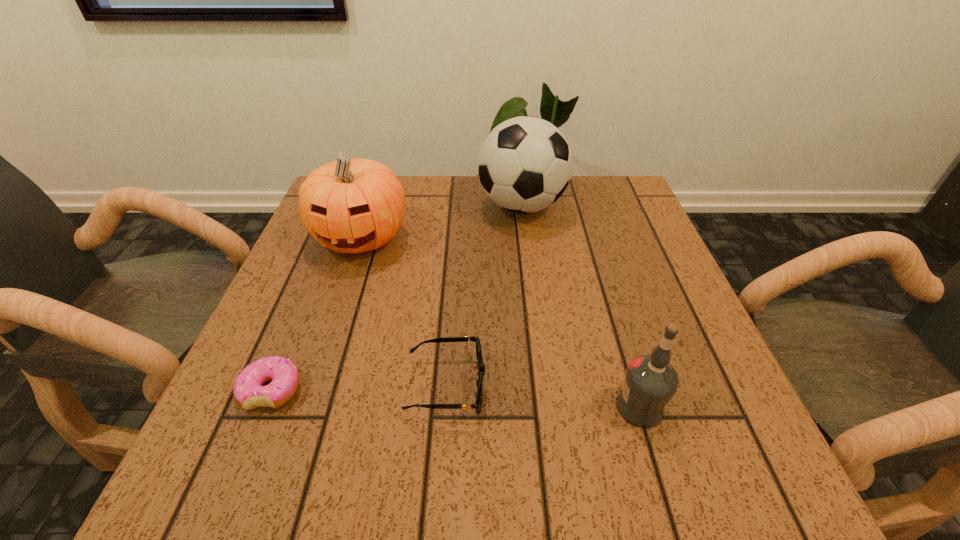
The height and width of the screenshot is (540, 960). Identify the location of free space between the doughnut and the vodka. (456, 399).

Identify the location of free area in between the doughnut and the pumpkin. The image size is (960, 540). (316, 313).

The width and height of the screenshot is (960, 540). Find the location of `free space that is in between the vodka and the soccer ball`. free space that is in between the vodka and the soccer ball is located at coordinates (581, 306).

This screenshot has height=540, width=960. Identify the location of object identified as the closest to the doughnut. (477, 406).

Find the location of a particular element. object that is the fourth closest one to the pumpkin is located at coordinates (650, 382).